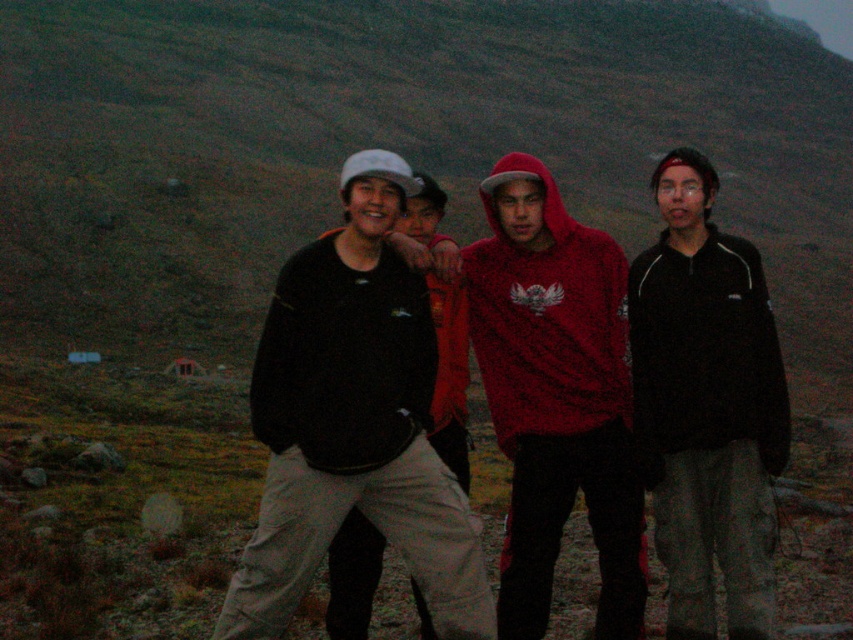
Is matte black shirt at center shorter than red hoodie at center?

Yes.

Which of these two, matte black shirt at center or red hoodie at center, stands shorter?

matte black shirt at center

Is point (409, 369) positioned in front of point (589, 413)?

Yes.

The width and height of the screenshot is (853, 640). I want to click on matte black shirt at center, so click(352, 420).

How distant is red hoodie at center from matte black jacket at center?

red hoodie at center is 3.28 feet from matte black jacket at center.

Does red hoodie at center have a greater width compared to matte black jacket at center?

No, red hoodie at center is not wider than matte black jacket at center.

Find the location of a particular element. red hoodie at center is located at coordinates (556, 396).

I want to click on red hoodie at center, so click(x=556, y=396).

Image resolution: width=853 pixels, height=640 pixels. What do you see at coordinates (352, 420) in the screenshot?
I see `matte black shirt at center` at bounding box center [352, 420].

Is point (416, 282) farther from viewer compared to point (730, 451)?

Yes, point (416, 282) is farther from viewer.

You are a GUI agent. You are given a task and a screenshot of the screen. Output one action in this format:
    pyautogui.click(x=<x>, y=<y>)
    Task: Click on the matte black shirt at center
    The height and width of the screenshot is (640, 853).
    Given the screenshot: What is the action you would take?
    pyautogui.click(x=352, y=420)